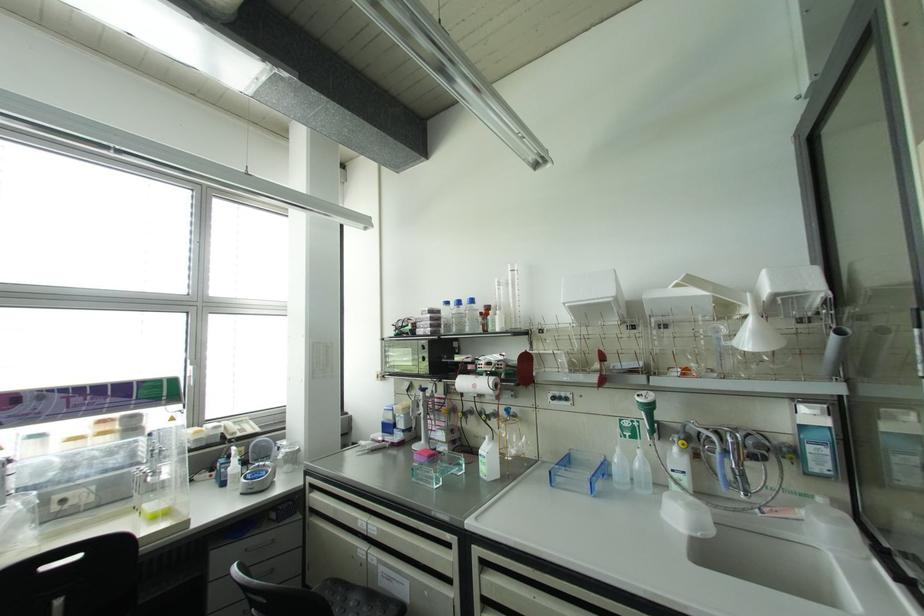
Find where to lift the white plastic funnel. Please return your answer as a coordinate pair (x, y).

(477, 384)